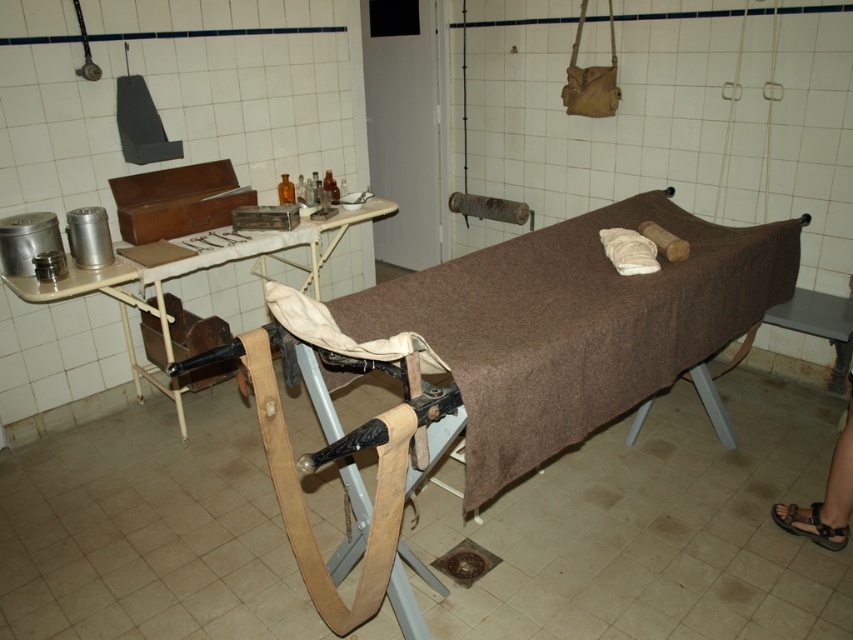
Who is taller, brown fabric bed at center or metallic silver tray at upper left?

brown fabric bed at center is taller.

Which is behind, point (659, 376) or point (161, 333)?

The point (161, 333) is more distant.

The width and height of the screenshot is (853, 640). What are the coordinates of `brown fabric bed at center` in the screenshot? It's located at (576, 328).